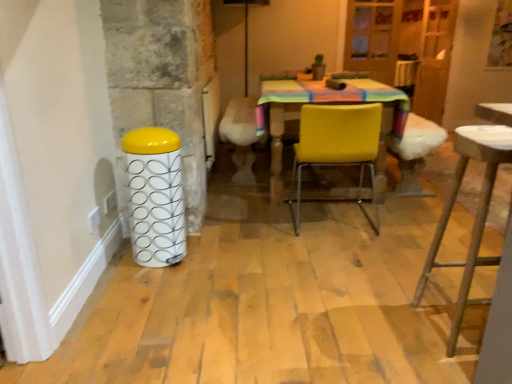
Identify the location of vacant space situated above yellow matte chair at center (from a real-world perspective). (347, 100).